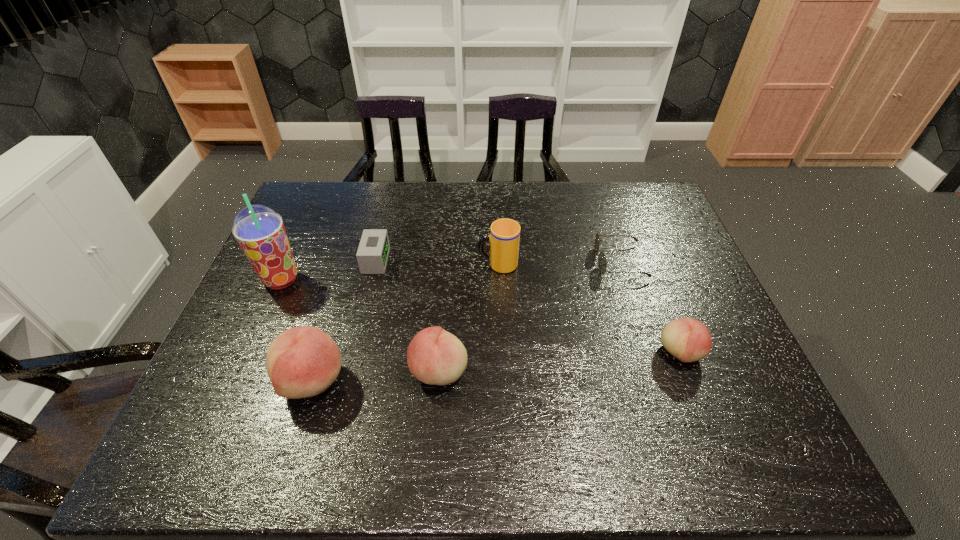
The width and height of the screenshot is (960, 540). Find the location of `blank space located 0.050m on the right of the leftmost peach`. blank space located 0.050m on the right of the leftmost peach is located at coordinates (368, 380).

Locate an element on the screen. free space located on the left of the fourth object from right to left is located at coordinates (262, 370).

I want to click on vacant region located 0.260m on the back of the fifth tallest object, so click(646, 265).

Identify the location of vacant space located on the front-facing side of the alarm clock. The height and width of the screenshot is (540, 960). (518, 260).

Where is `vacant area located on the side of the cup with the handle`? vacant area located on the side of the cup with the handle is located at coordinates pos(417,265).

You are a GUI agent. You are given a task and a screenshot of the screen. Output one action in this format:
    pyautogui.click(x=<x>, y=<y>)
    Task: Click on the vacant space located on the side of the cup with the handle
    
    Given the screenshot: What is the action you would take?
    pyautogui.click(x=410, y=265)

You are a GUI agent. You are given a task and a screenshot of the screen. Output one action in this format:
    pyautogui.click(x=<x>, y=<y>)
    Task: Click on the free space located on the side of the cup with the handle
    Image resolution: width=960 pixels, height=540 pixels.
    Given the screenshot: What is the action you would take?
    pyautogui.click(x=423, y=265)

Identify the location of vacant space located on the lenses of the sunglasses. The width and height of the screenshot is (960, 540). (464, 262).

Image resolution: width=960 pixels, height=540 pixels. Identify the location of vacant space positioned on the lenses of the sunglasses. pos(484,262).

The height and width of the screenshot is (540, 960). Identify the location of vacant space positioned on the lenses of the sunglasses. (491, 262).